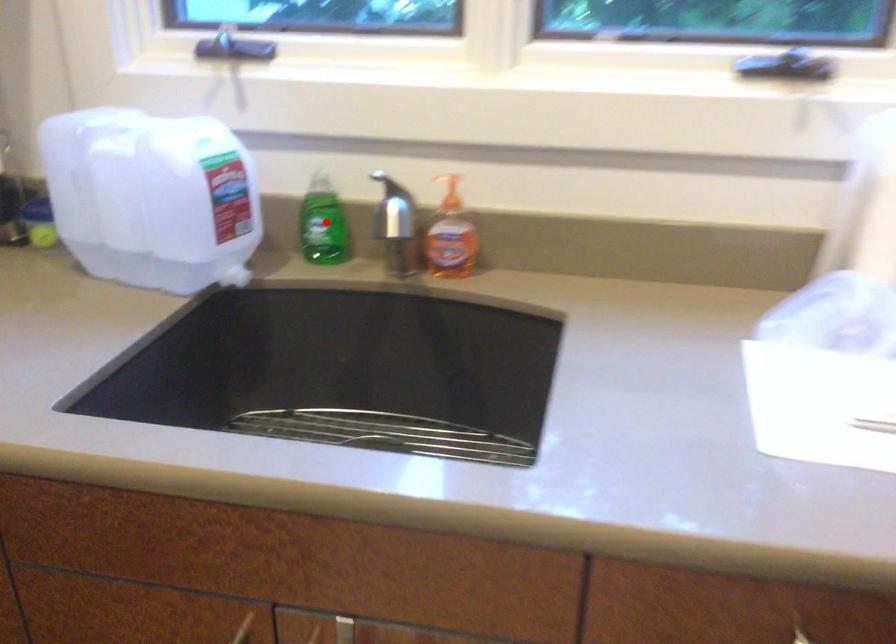
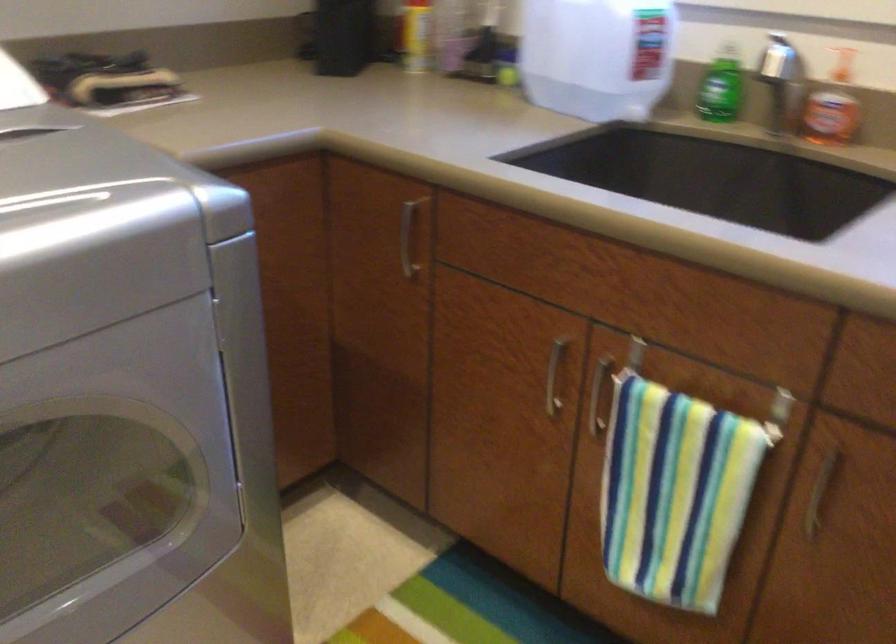
Question: I am providing you with two images of the same scene from different viewpoints. In image1, a red point is highlighted. Considering the same 3D point in image2, which of the following is correct?

Choices:
 (A) It is closer
 (B) It is farther

Answer: (B)